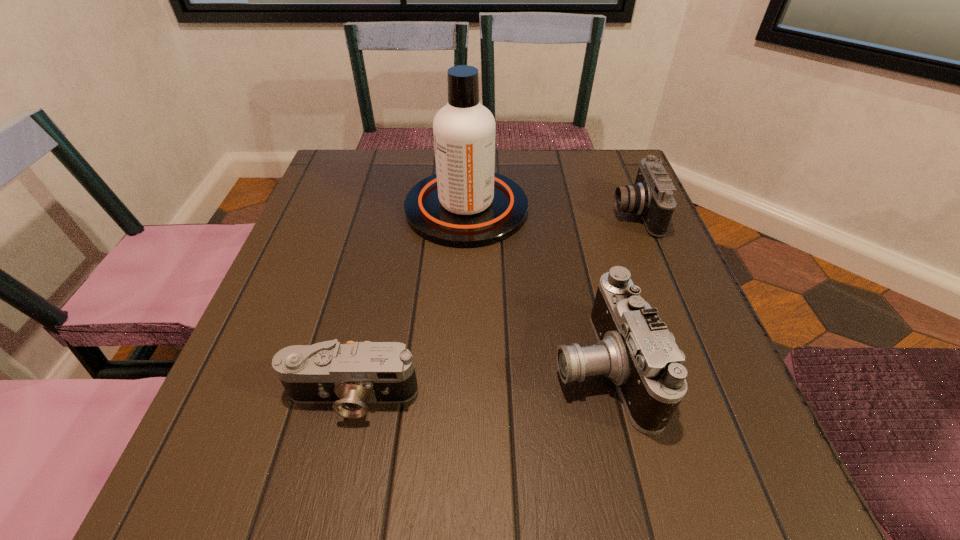
The width and height of the screenshot is (960, 540). Find the location of `the tallest object`. the tallest object is located at coordinates (466, 204).

At what (x,y) coordinates should I click in order to perform the action: click on the second camera from right to left. Please return your answer as a coordinate pair (x, y). This screenshot has width=960, height=540. Looking at the image, I should click on (635, 349).

The height and width of the screenshot is (540, 960). I want to click on the farthest camera, so click(651, 196).

I want to click on the rightmost object, so click(651, 196).

Locate an element on the screen. the shortest object is located at coordinates (349, 376).

The width and height of the screenshot is (960, 540). I want to click on the shortest camera, so click(x=349, y=376).

This screenshot has width=960, height=540. I want to click on free space located 0.370m on the front of the cleansing agent, so click(x=459, y=410).

Locate an element on the screen. free space located 0.400m at the lens of the third object from left to right is located at coordinates (309, 366).

Image resolution: width=960 pixels, height=540 pixels. Identify the location of free region located 0.230m at the lens of the third object from left to right. (413, 366).

Locate an element on the screen. The height and width of the screenshot is (540, 960). vacant space located at the lens of the third object from left to right is located at coordinates (x=315, y=366).